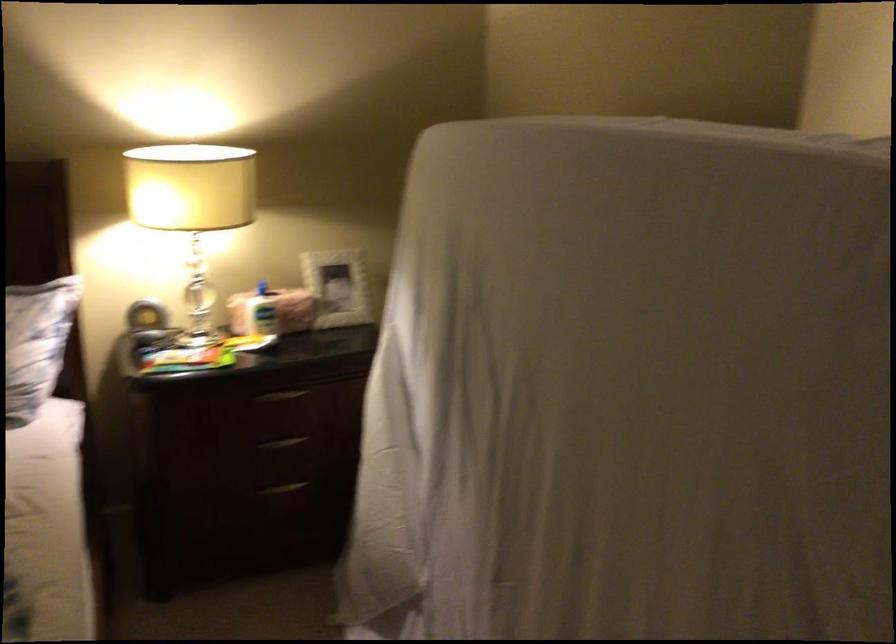
Image resolution: width=896 pixels, height=644 pixels. I want to click on white picture frame, so click(x=337, y=287).